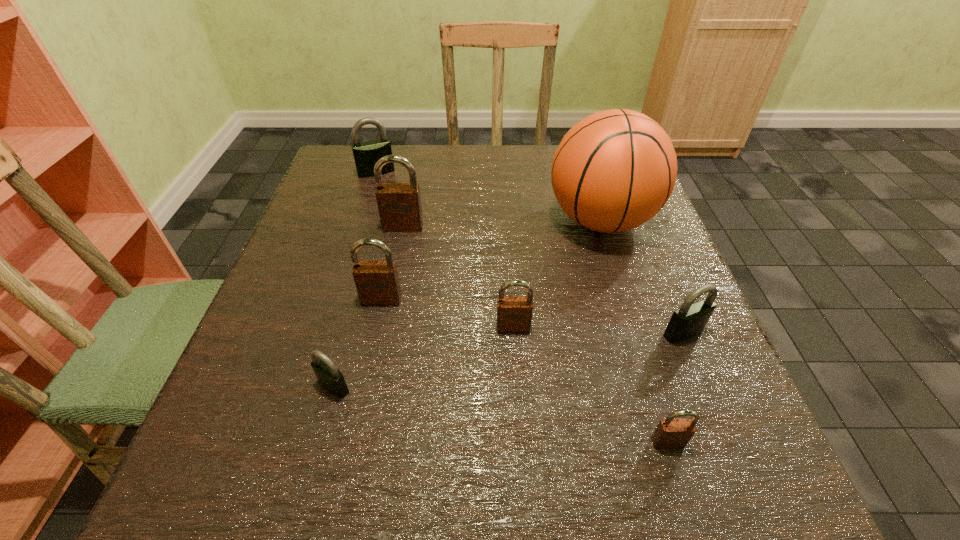
In the image, there is a desktop. At what (x,y) coordinates should I click in order to perform the action: click on free space at the far left corner. Please return your answer as a coordinate pair (x, y). Looking at the image, I should click on (328, 190).

Where is `vacant region at the near right corner of the desktop`? The height and width of the screenshot is (540, 960). vacant region at the near right corner of the desktop is located at coordinates (770, 486).

At what (x,y) coordinates should I click in order to perform the action: click on free spot between the rightmost padlock and the nearest object. Please return your answer as a coordinate pair (x, y). This screenshot has width=960, height=540. Looking at the image, I should click on (676, 387).

This screenshot has width=960, height=540. What are the coordinates of `vacant space in between the farthest black padlock and the fifth padlock from left to right` in the screenshot? It's located at (444, 250).

This screenshot has height=540, width=960. What are the coordinates of `free space between the biggest black padlock and the basketball` in the screenshot? It's located at (489, 197).

I want to click on free space between the basketball and the biggest brown padlock, so click(x=502, y=224).

Find the location of a particular element. blank region between the third farthest brown padlock and the farthest padlock is located at coordinates (444, 250).

The height and width of the screenshot is (540, 960). Identify the location of free point between the nearest black padlock and the second nearest black padlock. (509, 360).

Locate an element on the screen. unoccupied area between the farthest object and the tallest object is located at coordinates (489, 197).

Locate which object is the closest to the nearest black padlock. Please provide its 2D coordinates. Your answer should be formatted as a tuple, i.e. [(x, y)], where the tuple contains the x and y coordinates of a point satisfying the conditions above.

[(377, 282)]